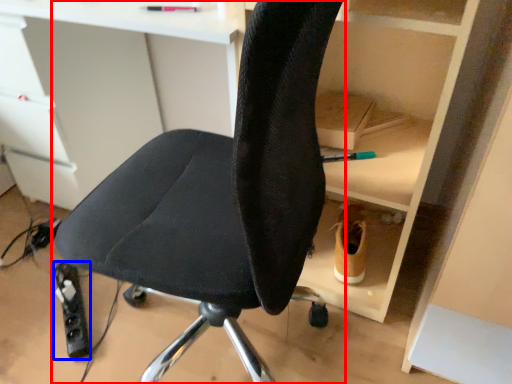
Question: Which object is closer to the camera taking this photo, chair (highlighted by a red box) or equipment (highlighted by a blue box)?

Choices:
 (A) chair
 (B) equipment

Answer: (A)